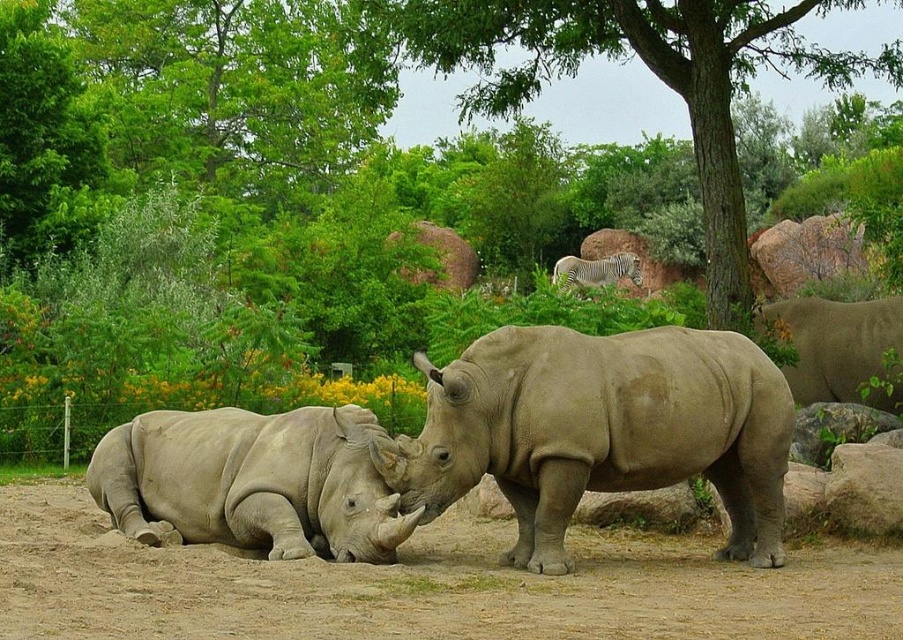
You are a wildlife photographer standing at a safe distance from the rhinos. You want to take a photo of the rhinos using a camera that has a maximum focus range of 6 meters. Is the point where you are standing, which is at coordinates point (541, 630), within the camera focus range?

The point (541, 630) is 6.65 meters away from the camera. Since the camera can only focus up to 6 meters, the point is beyond the maximum focus range, so the camera cannot focus on that point.